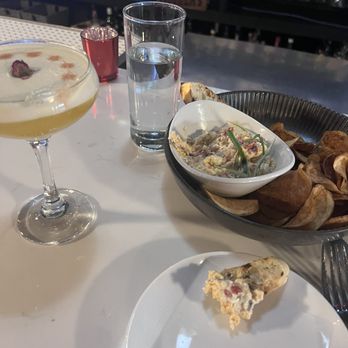
This screenshot has width=348, height=348. Find the location of `table`. table is located at coordinates (127, 190).